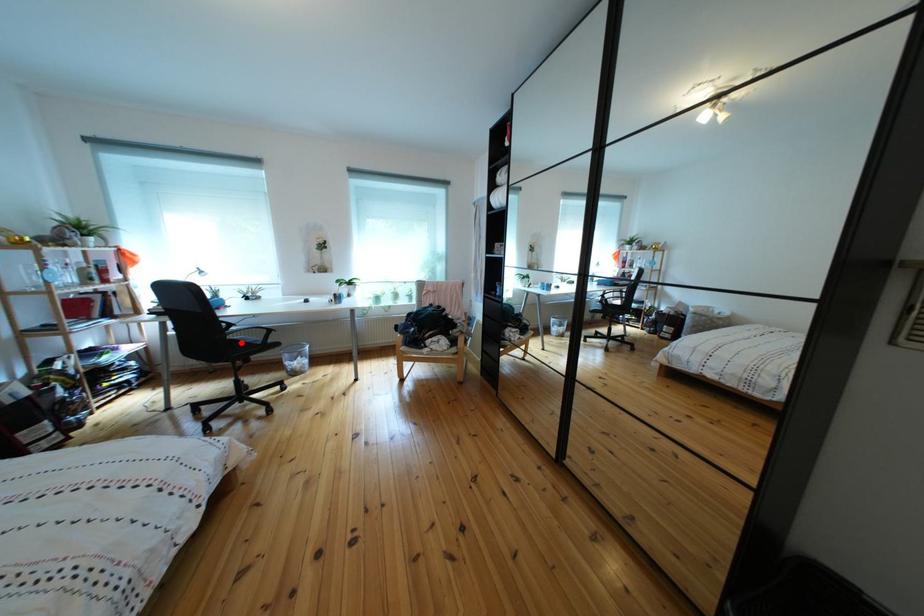
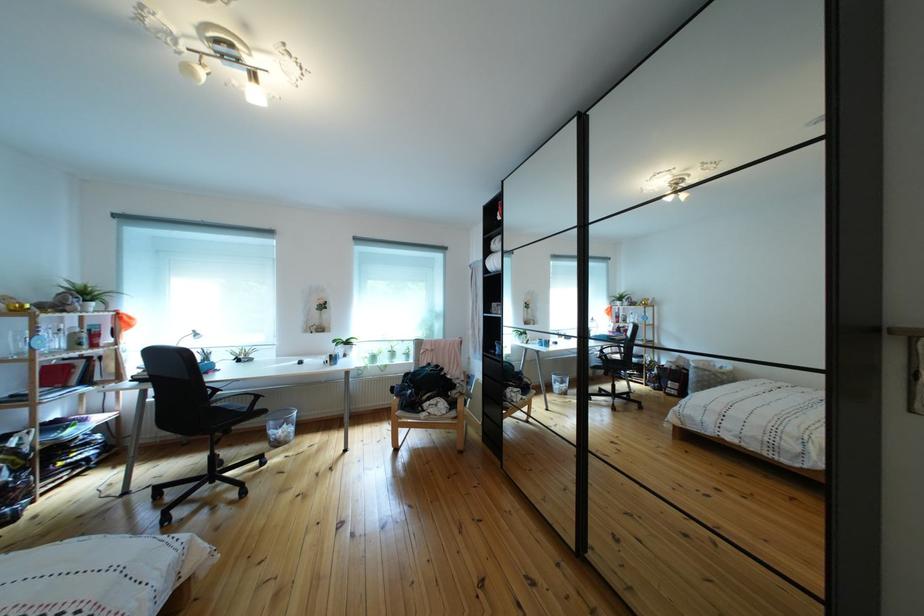
The point at the highlighted location is marked in the first image. Where is the corresponding point in the second image?

(225, 411)